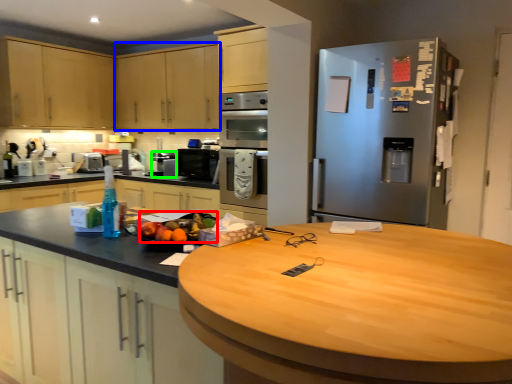
Question: Which object is the farthest from fruit (highlighted by a red box)? Choose among these: cabinetry (highlighted by a blue box) or appliance (highlighted by a green box).

Choices:
 (A) cabinetry
 (B) appliance

Answer: (A)